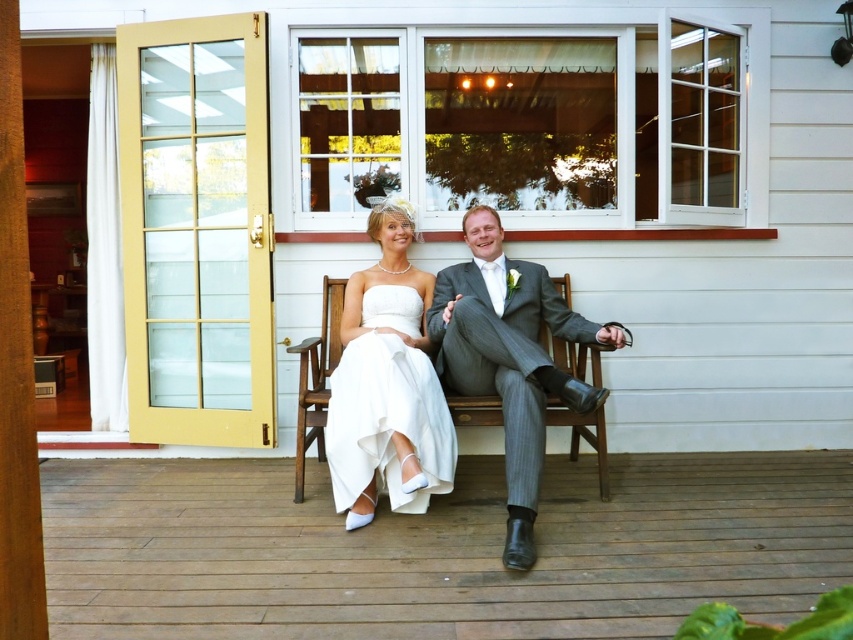
Question: In this image, where is white satin dress at center located relative to gray striped suit at center?

Choices:
 (A) above
 (B) below

Answer: (A)

Question: Which of the following is the farthest from the observer?

Choices:
 (A) (474, 381)
 (B) (550, 339)
 (C) (508, 627)

Answer: (B)

Question: Which point appears closest to the camera in this image?

Choices:
 (A) (300, 369)
 (B) (366, 276)

Answer: (A)

Question: Which of the following is the closest to the observer?

Choices:
 (A) wooden floor at lower center
 (B) gray striped suit at center
 (C) white satin dress at center
 (D) wooden bench at center

Answer: (A)

Question: Is white satin dress at center to the left of gray striped suit at center from the viewer's perspective?

Choices:
 (A) no
 (B) yes

Answer: (B)

Question: Does gray striped suit at center have a larger size compared to wooden bench at center?

Choices:
 (A) yes
 (B) no

Answer: (A)